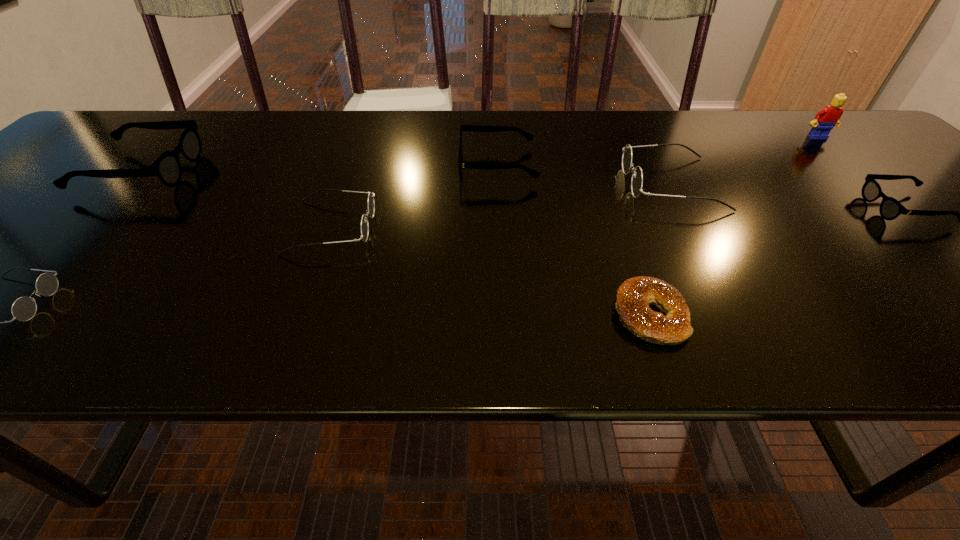
Locate an element on the screen. The image size is (960, 540). the smallest black spectacles is located at coordinates (890, 208).

At what (x,y) coordinates should I click in order to perform the action: click on tan bagel. Please return your answer as a coordinate pair (x, y). The width and height of the screenshot is (960, 540). Looking at the image, I should click on (634, 296).

Identify the location of free space located 0.130m on the face of the Lego. The image size is (960, 540). (850, 167).

The image size is (960, 540). I want to click on vacant space located 0.180m on the arms of the leftmost black spectacles, so click(265, 171).

Find the location of a particular element. free space located 0.240m through the lenses of the rightmost dark spectacles is located at coordinates click(520, 183).

The image size is (960, 540). Find the location of `blank area located 0.100m through the lenses of the rightmost dark spectacles`. blank area located 0.100m through the lenses of the rightmost dark spectacles is located at coordinates (582, 183).

Identify the location of free space located through the lenses of the rightmost dark spectacles. (577, 183).

Locate an element on the screen. The width and height of the screenshot is (960, 540). vacant area situated on the arms of the fourth spectacles from left to right is located at coordinates (423, 165).

Identify the location of free space located on the arms of the fourth spectacles from left to right. This screenshot has height=540, width=960. (344, 165).

You are a GUI agent. You are given a task and a screenshot of the screen. Output one action in this format:
    pyautogui.click(x=<x>, y=<y>)
    Task: Click on the vacant region located 0.390m on the arms of the fourth spectacles from left to right
    
    Given the screenshot: What is the action you would take?
    pyautogui.click(x=298, y=165)